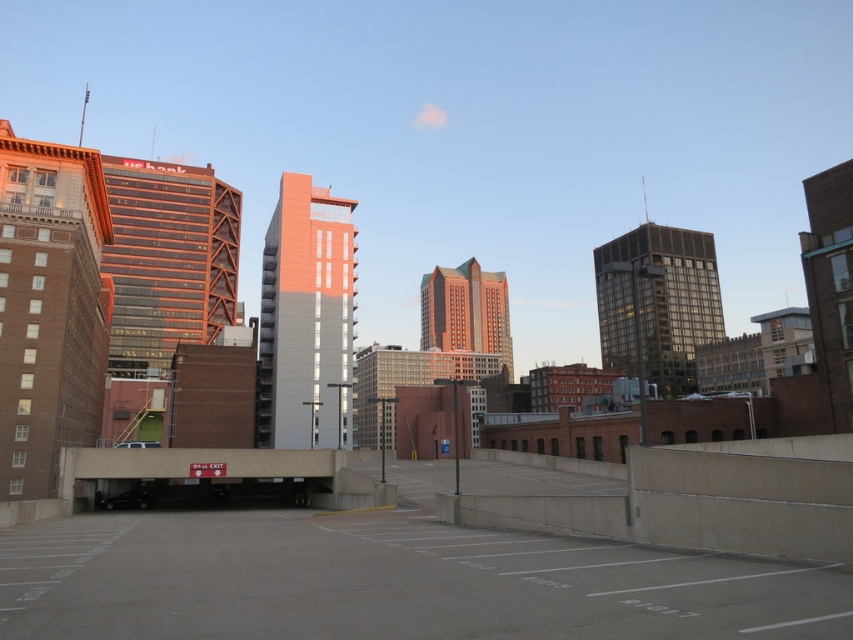
Does gray concrete parking lot at center come in front of shiny black sedan at lower left?

Yes, gray concrete parking lot at center is closer to the viewer.

Is point (105, 586) positioned behind point (138, 497)?

That is False.

Locate an element on the screen. The image size is (853, 640). gray concrete parking lot at center is located at coordinates (387, 582).